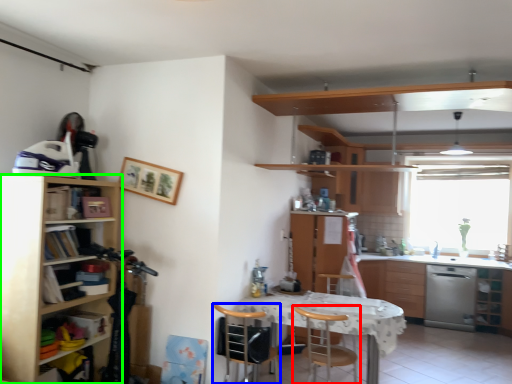
Question: Considering the real-world distances, which object is closest to chair (highlighted by a red box)? chair (highlighted by a blue box) or cabinetry (highlighted by a green box).

Choices:
 (A) chair
 (B) cabinetry

Answer: (A)